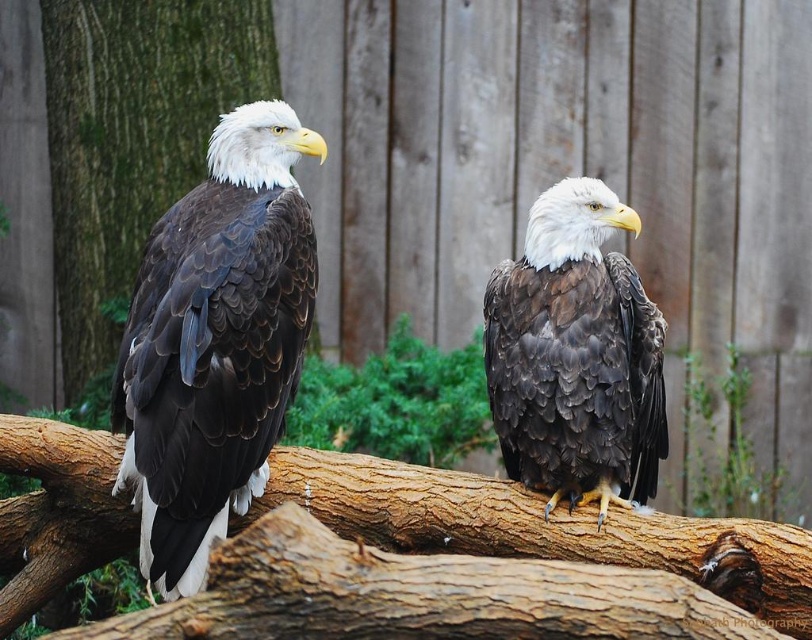
Question: Does dark brown feathers at left appear on the left side of brown rough wood at center?

Choices:
 (A) yes
 (B) no

Answer: (A)

Question: Which point is farther to the camera?

Choices:
 (A) dark brown feathers at center
 (B) dark brown feathers at left
 (C) brown rough wood at center
 (D) green bark tree at left

Answer: (D)

Question: Estimate the real-world distances between objects in this image. Which object is farther from the green bark tree at left?

Choices:
 (A) dark brown feathers at left
 (B) brown rough wood at center
 (C) dark brown feathers at center

Answer: (C)

Question: Which of the following is the closest to the observer?

Choices:
 (A) dark brown feathers at left
 (B) green bark tree at left
 (C) dark brown feathers at center

Answer: (A)

Question: Where is dark brown feathers at left located in relation to green bark tree at left in the image?

Choices:
 (A) left
 (B) right

Answer: (B)

Question: Where is dark brown feathers at left located in relation to brown rough wood at center in the image?

Choices:
 (A) right
 (B) left

Answer: (B)